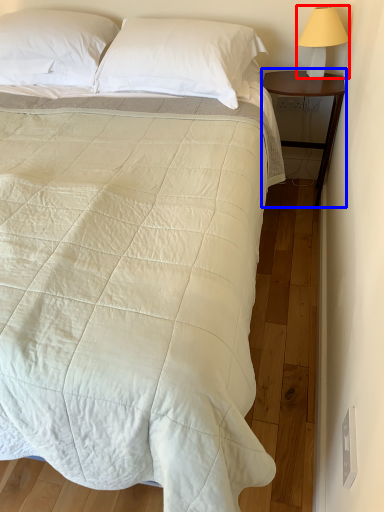
Question: Which of the following is the closest to the observer, bedside lamp (highlighted by a red box) or nightstand (highlighted by a blue box)?

Choices:
 (A) bedside lamp
 (B) nightstand

Answer: (A)